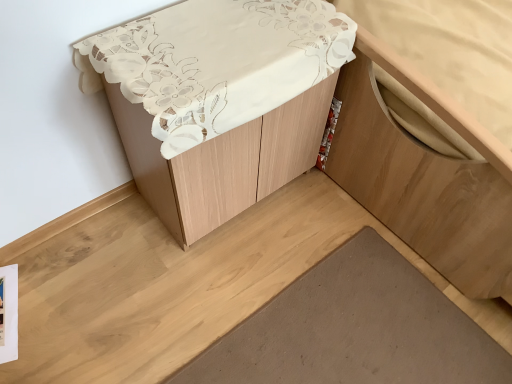
Question: Is wooden cabinet at lower right taller than matte white cabinet at center?

Choices:
 (A) yes
 (B) no

Answer: (B)

Question: From the image's perspective, is wooden cabinet at lower right located beneath matte white cabinet at center?

Choices:
 (A) yes
 (B) no

Answer: (B)

Question: Are wooden cabinet at lower right and matte white cabinet at center making contact?

Choices:
 (A) no
 (B) yes

Answer: (A)

Question: Is wooden cabinet at lower right wider than matte white cabinet at center?

Choices:
 (A) yes
 (B) no

Answer: (A)

Question: Can you confirm if wooden cabinet at lower right is positioned to the right of matte white cabinet at center?

Choices:
 (A) yes
 (B) no

Answer: (A)

Question: Is the depth of wooden cabinet at lower right greater than that of matte white cabinet at center?

Choices:
 (A) yes
 (B) no

Answer: (B)

Question: Does matte white cabinet at center turn towards brown matte wood plank at lower center?

Choices:
 (A) yes
 (B) no

Answer: (A)

Question: Considering the relative positions of matte white cabinet at center and brown matte wood plank at lower center in the image provided, is matte white cabinet at center to the right of brown matte wood plank at lower center from the viewer's perspective?

Choices:
 (A) yes
 (B) no

Answer: (B)

Question: Is matte white cabinet at center to the left of brown matte wood plank at lower center from the viewer's perspective?

Choices:
 (A) no
 (B) yes

Answer: (B)

Question: Is the surface of matte white cabinet at center in direct contact with brown matte wood plank at lower center?

Choices:
 (A) yes
 (B) no

Answer: (B)

Question: Can you confirm if matte white cabinet at center is thinner than brown matte wood plank at lower center?

Choices:
 (A) yes
 (B) no

Answer: (A)

Question: Is matte white cabinet at center completely or partially outside of brown matte wood plank at lower center?

Choices:
 (A) no
 (B) yes

Answer: (B)

Question: Is brown matte wood plank at lower center closer to camera compared to matte white cabinet at center?

Choices:
 (A) no
 (B) yes

Answer: (A)